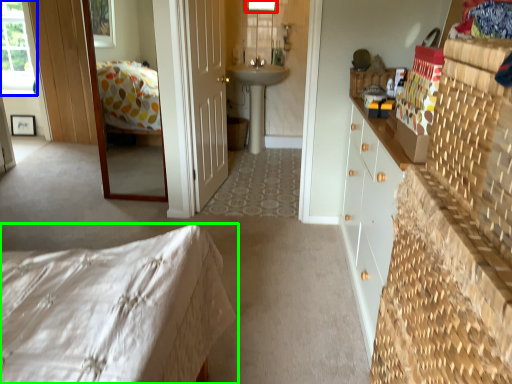
Question: Based on their relative distances, which object is farther from window (highlighted by a red box)? Choose from window (highlighted by a blue box) and bed (highlighted by a green box).

Choices:
 (A) window
 (B) bed

Answer: (B)